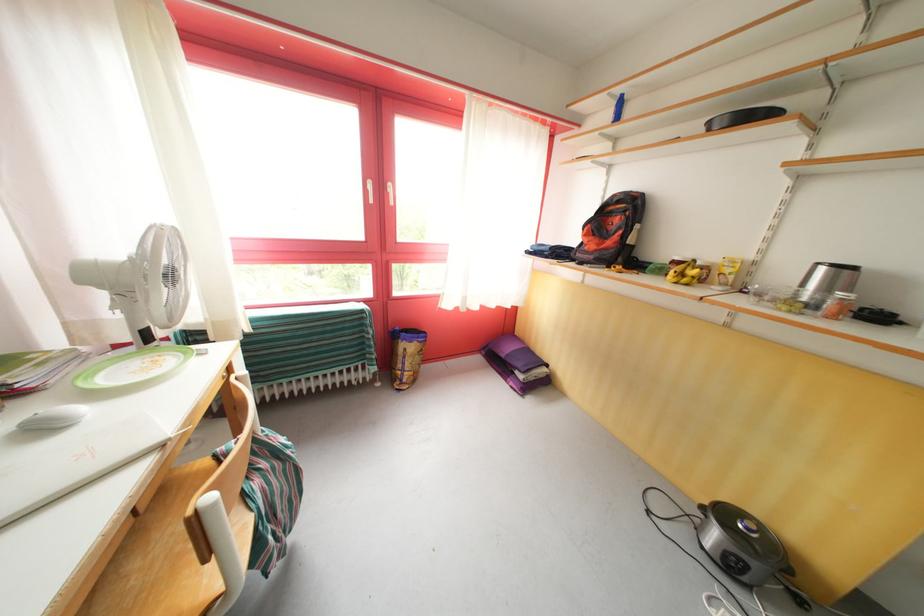
Identify the location of blue plastic bottle. (617, 108).